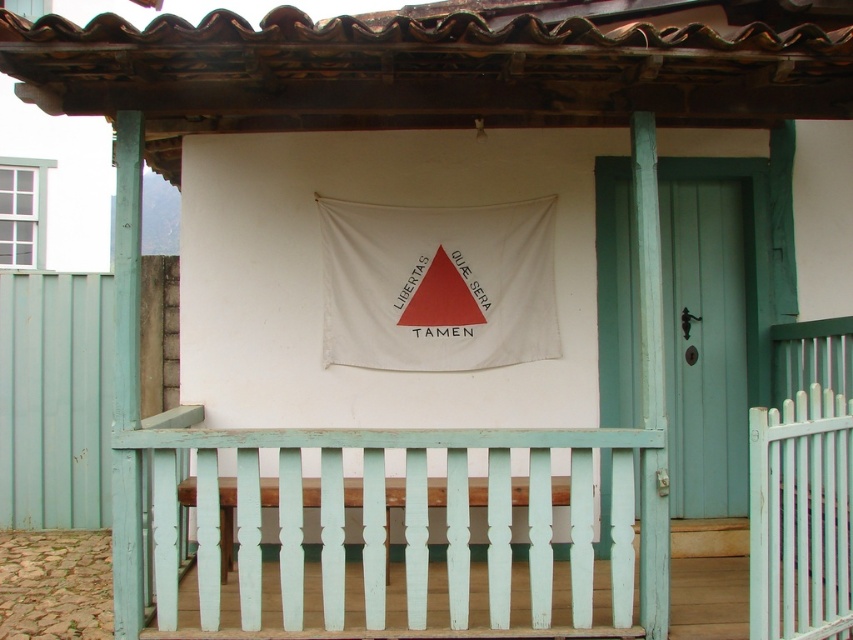
You are an architect designing a new building inspired by traditional styles. You want to incorporate elements from this scene. If you plan to use both the light teal wood at center and the teal wooden door at center right in your design, which element should you allocate more space to in terms of size?

The light teal wood at center is larger in size than the teal wooden door at center right, so you should allocate more space to the light teal wood at center in your design.

You are standing in front of the traditional building described. There is a point marked at coordinates (410,532). What material is located at that point?

The point at coordinates (410,532) corresponds to light teal wood at center.

You are standing in front of the traditional building and want to determine the relative positions of two points marked on the image. Which point is nearer to you, point 1 at coordinates (341, 570) or point 2 at coordinates (749, 237)?

Point 1 at coordinates (341, 570) is closer to the viewer than point 2 at coordinates (749, 237).